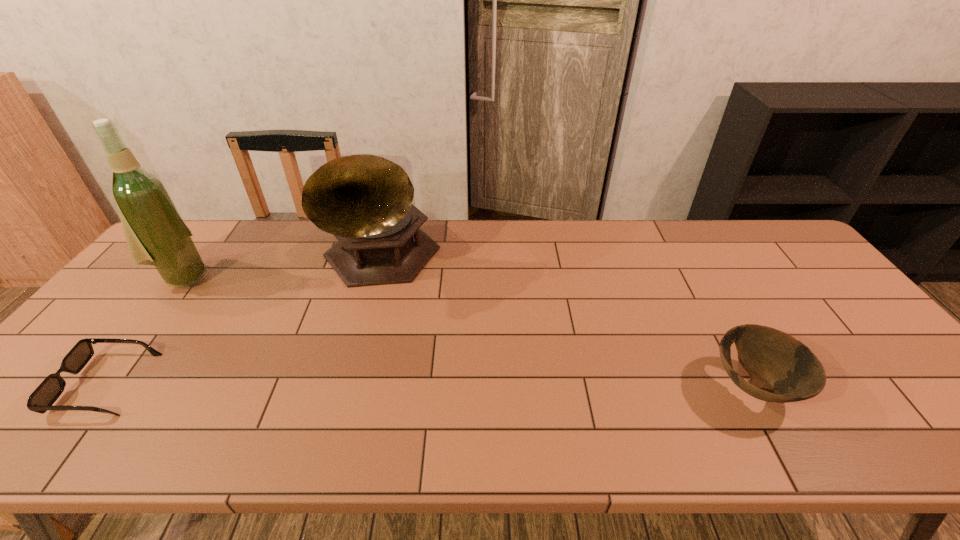
Identify the location of vacant area between the bowl and the sunglasses. (430, 386).

In order to click on vacant space that's between the tallest object and the shortest object in this screenshot , I will do `click(145, 330)`.

This screenshot has width=960, height=540. What are the coordinates of `free space that is in between the shortest object and the second shortest object` in the screenshot? It's located at (430, 386).

Where is `vacant region between the wine bottle and the second tallest object`? The image size is (960, 540). vacant region between the wine bottle and the second tallest object is located at coordinates (282, 269).

Where is `vacant space that's between the wine bottle and the shortest object`? Image resolution: width=960 pixels, height=540 pixels. vacant space that's between the wine bottle and the shortest object is located at coordinates (145, 330).

In order to click on empty space between the wine bottle and the rightmost object in this screenshot , I will do `click(469, 332)`.

Identify the location of free space between the third object from left to right and the tallest object. (282, 269).

This screenshot has width=960, height=540. What are the coordinates of `object that is the third closest to the shortest object` in the screenshot? It's located at (776, 362).

Point out which object is positioned as the third nearest to the wine bottle. Please provide its 2D coordinates. Your answer should be formatted as a tuple, i.e. [(x, y)], where the tuple contains the x and y coordinates of a point satisfying the conditions above.

[(776, 362)]

The height and width of the screenshot is (540, 960). I want to click on free space that satisfies the following two spatial constraints: 1. on the front side of the tallest object; 2. on the right side of the third tallest object, so click(99, 387).